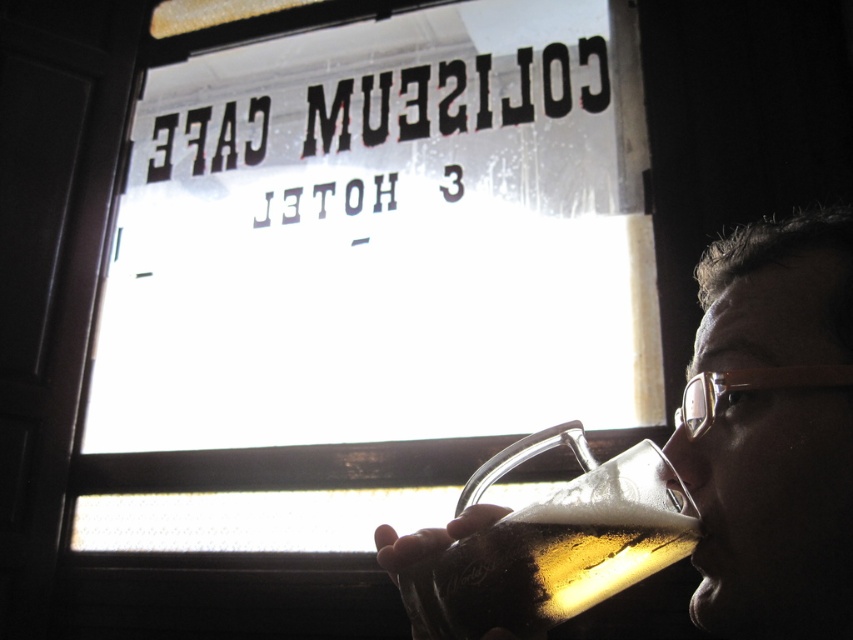
Question: Does translucent glass mug at upper center have a smaller size compared to translucent glass mug at lower center?

Choices:
 (A) yes
 (B) no

Answer: (B)

Question: Among these points, which one is farthest from the camera?

Choices:
 (A) (492, 614)
 (B) (819, 502)
 (C) (173, 353)

Answer: (C)

Question: Is transparent glass window at center bigger than translucent glass mug at lower center?

Choices:
 (A) no
 (B) yes

Answer: (B)

Question: Among these objects, which one is farthest from the camera?

Choices:
 (A) translucent glass mug at lower center
 (B) transparent glass window at center
 (C) translucent glass mug at upper center

Answer: (B)

Question: Can you confirm if translucent glass mug at upper center is bigger than translucent glass mug at lower center?

Choices:
 (A) no
 (B) yes

Answer: (B)

Question: Which object is the closest to the translucent glass mug at lower center?

Choices:
 (A) translucent glass mug at upper center
 (B) transparent glass window at center

Answer: (A)